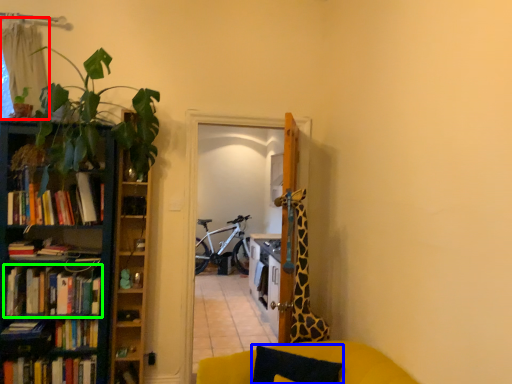
Question: Estimate the real-world distances between objects in this image. Which object is closer to curtain (highlighted by a red box), pillow (highlighted by a blue box) or book (highlighted by a green box)?

Choices:
 (A) pillow
 (B) book

Answer: (B)